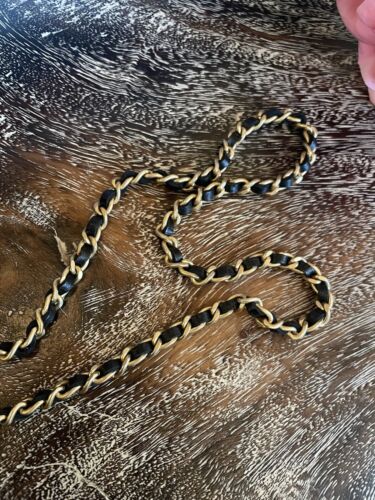
This screenshot has height=500, width=375. I want to click on black on table, so click(27, 65), click(44, 22), click(149, 67), click(249, 11).